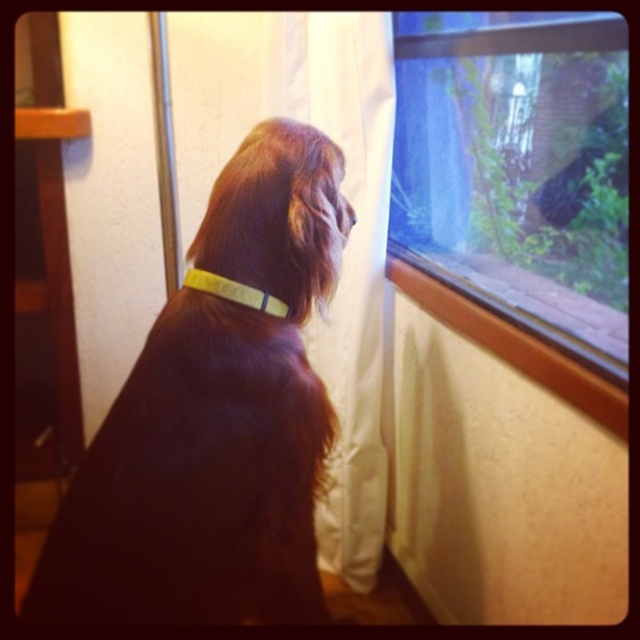
Can you confirm if white fabric curtain at center is shorter than yellow fabric neckband at center?

No.

Who is lower down, white fabric curtain at center or yellow fabric neckband at center?

white fabric curtain at center

Who is more distant from viewer, [346,369] or [259,291]?

The point [346,369] is more distant.

Where is `white fabric curtain at center`? This screenshot has height=640, width=640. white fabric curtain at center is located at coordinates (346, 256).

Which of these two, brown fur dog at center or brown fur nose at upper center, stands taller?

With more height is brown fur dog at center.

The image size is (640, 640). Describe the element at coordinates (216, 420) in the screenshot. I see `brown fur dog at center` at that location.

Locate an element on the screen. brown fur dog at center is located at coordinates (216, 420).

Consider the image. Who is positioned more to the left, brown fur dog at center or white fabric curtain at center?

brown fur dog at center is more to the left.

Between point (317, 448) and point (371, 244), which one is positioned in front?

Point (317, 448)

The image size is (640, 640). Identify the location of brown fur dog at center. (216, 420).